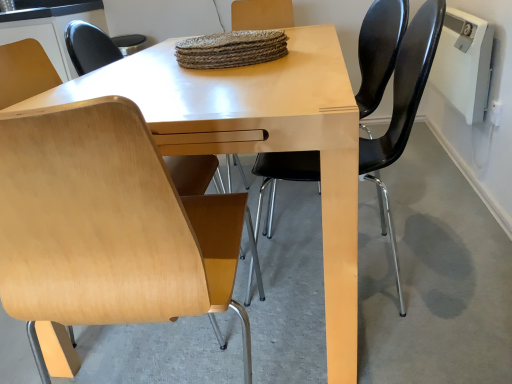
Where is `free location to the right of black leather chair at right, which appears as the first chair when viewed from the right`? The image size is (512, 384). free location to the right of black leather chair at right, which appears as the first chair when viewed from the right is located at coordinates (457, 258).